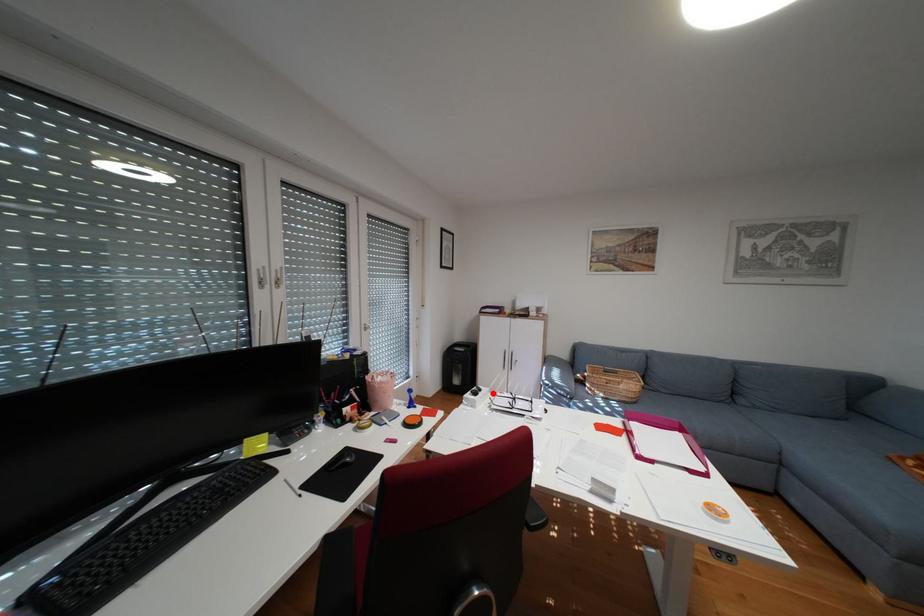
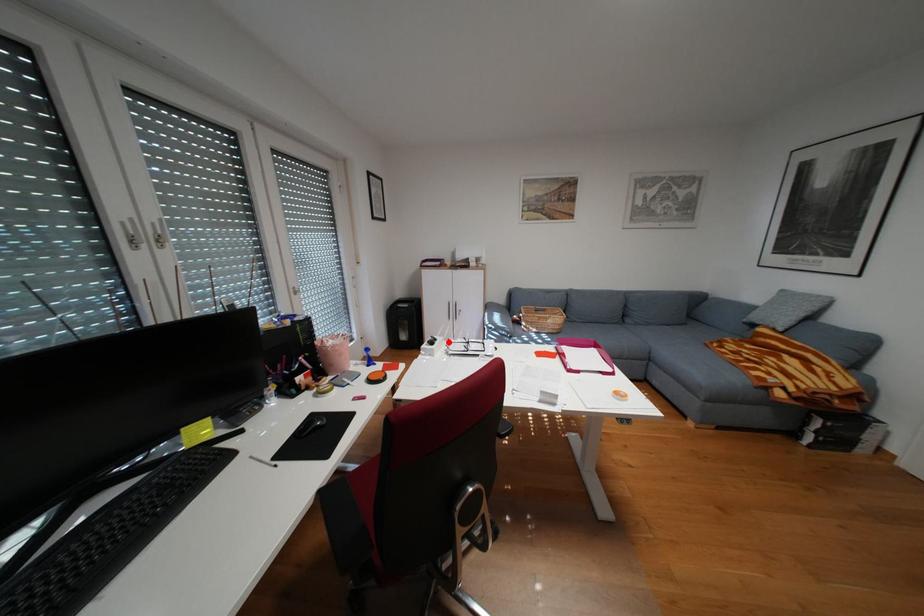
I am providing you with two images of the same scene from different viewpoints. A red point is marked on the first image and another point is marked on the second image. Are the points marked in image1 and image2 representing the same 3D position?

Yes